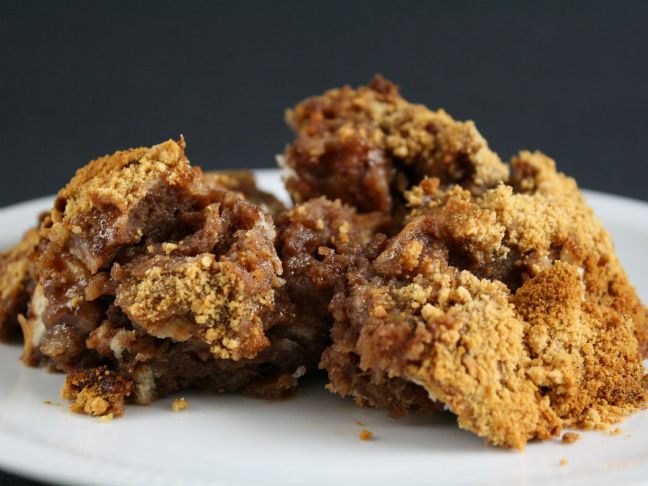
Image resolution: width=648 pixels, height=486 pixels. I want to click on front edge of plate, so click(43, 466).